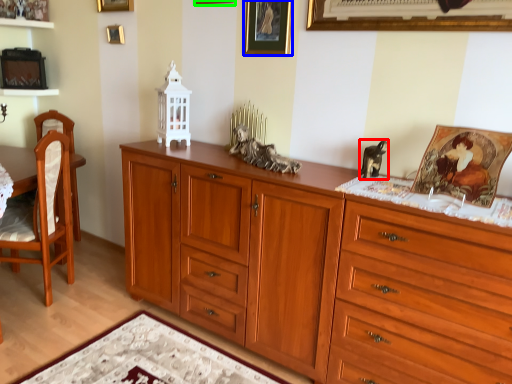
Question: Estimate the real-world distances between objects in this image. Which object is closer to animal (highlighted by a red box), picture frame (highlighted by a blue box) or picture frame (highlighted by a green box)?

Choices:
 (A) picture frame
 (B) picture frame

Answer: (A)